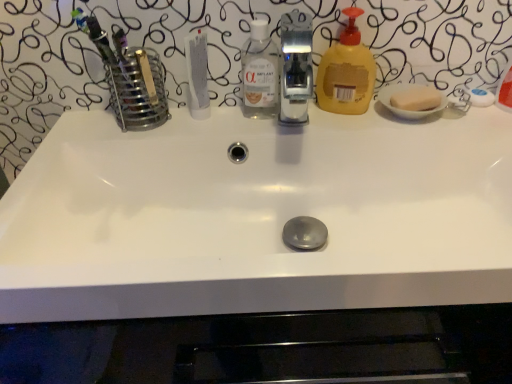
Describe the element at coordinates (197, 74) in the screenshot. The height and width of the screenshot is (384, 512). I see `white matte tube at center` at that location.

Describe the element at coordinates (296, 67) in the screenshot. The height and width of the screenshot is (384, 512). I see `satin nickel faucet at center` at that location.

At what (x,y) coordinates should I click in order to perform the action: click on yellow translucent liquid soap at right. Please return your answer as a coordinate pair (x, y). Looking at the image, I should click on (346, 72).

Is yellow translucent liquid soap at right located within white matte tube at center?

No, yellow translucent liquid soap at right is not inside white matte tube at center.

What's the angular difference between white matte tube at center and yellow translucent liquid soap at right's facing directions?

They differ by 55.8 degrees in their facing directions.

From their relative heights in the image, would you say white matte tube at center is taller or shorter than yellow translucent liquid soap at right?

white matte tube at center is shorter than yellow translucent liquid soap at right.

Based on their sizes in the image, would you say white matte tube at center is bigger or smaller than yellow translucent liquid soap at right?

Clearly, white matte tube at center is smaller in size than yellow translucent liquid soap at right.

Is transparent plastic bottle at center a part of satin nickel faucet at center?

No, transparent plastic bottle at center is located outside of satin nickel faucet at center.

Does satin nickel faucet at center turn towards transparent plastic bottle at center?

No, satin nickel faucet at center is not facing towards transparent plastic bottle at center.

From their relative heights in the image, would you say satin nickel faucet at center is taller or shorter than transparent plastic bottle at center?

Clearly, satin nickel faucet at center is shorter compared to transparent plastic bottle at center.

From the picture: From the image's perspective, which one is positioned higher, satin nickel faucet at center or transparent plastic bottle at center?

From the image's view, transparent plastic bottle at center is above.

Does transparent plastic bottle at center lie behind satin nickel faucet at center?

Yes, transparent plastic bottle at center is further from the viewer.

How different are the orientations of transparent plastic bottle at center and satin nickel faucet at center in degrees?

The angle between the facing direction of transparent plastic bottle at center and the facing direction of satin nickel faucet at center is 0.00231 degrees.

This screenshot has width=512, height=384. What are the coordinates of `fixture in front of the transparent plastic bottle at center` in the screenshot? It's located at (296, 67).

Is there a large distance between white matte tube at center and satin nickel faucet at center?

Yes, white matte tube at center and satin nickel faucet at center are located far from each other.

From a real-world perspective, is white matte tube at center positioned above or below satin nickel faucet at center?

In terms of real-world spatial position, white matte tube at center is below satin nickel faucet at center.

Which is closer, (206, 49) or (306, 51)?

Point (206, 49)

Identify the location of toothpaste on the left of satin nickel faucet at center. (197, 74).

From the image's perspective, is yellow translucent liquid soap at right over transparent plastic bottle at center?

Indeed, from the image's perspective, yellow translucent liquid soap at right is shown above transparent plastic bottle at center.

Is transparent plastic bottle at center located within yellow translucent liquid soap at right?

No, transparent plastic bottle at center is not inside yellow translucent liquid soap at right.

Is transparent plastic bottle at center oriented towards white matte tube at center?

No, transparent plastic bottle at center is not aimed at white matte tube at center.

Locate an element on the screen. toothpaste below the transparent plastic bottle at center (from the image's perspective) is located at coordinates (197, 74).

Looking at their sizes, would you say transparent plastic bottle at center is wider or thinner than white matte tube at center?

Considering their sizes, transparent plastic bottle at center looks broader than white matte tube at center.

Which of these two, transparent plastic bottle at center or white matte tube at center, stands taller?

With more height is transparent plastic bottle at center.

Where is `toothpaste behind the satin nickel faucet at center`? toothpaste behind the satin nickel faucet at center is located at coordinates 197,74.

Is satin nickel faucet at center further to the viewer compared to white matte tube at center?

No, satin nickel faucet at center is closer to the camera.

Is white matte tube at center at the back of satin nickel faucet at center?

No, satin nickel faucet at center is not facing the opposite direction of white matte tube at center.

Based on their sizes in the image, would you say satin nickel faucet at center is bigger or smaller than white matte tube at center?

Clearly, satin nickel faucet at center is larger in size than white matte tube at center.

This screenshot has height=384, width=512. In order to click on cleaning product above the white matte tube at center (from the image's perspective) in this screenshot , I will do `click(346, 72)`.

The width and height of the screenshot is (512, 384). In order to click on bottle beneath the satin nickel faucet at center (from a real-world perspective) in this screenshot , I will do `click(259, 73)`.

Based on their spatial positions, is yellow translucent liquid soap at right or transparent plastic bottle at center further from satin nickel faucet at center?

transparent plastic bottle at center is positioned further to the anchor satin nickel faucet at center.

Estimate the real-world distances between objects in this image. Which object is further from transparent plastic bottle at center, satin nickel faucet at center or white matte tube at center?

Among the two, satin nickel faucet at center is located further to transparent plastic bottle at center.

Based on their spatial positions, is satin nickel faucet at center or yellow translucent liquid soap at right further from white matte tube at center?

Among the two, satin nickel faucet at center is located further to white matte tube at center.

Based on their spatial positions, is transparent plastic bottle at center or white matte tube at center closer to satin nickel faucet at center?

transparent plastic bottle at center lies closer to satin nickel faucet at center than the other object.

Looking at the image, which one is located further to satin nickel faucet at center, transparent plastic bottle at center or yellow translucent liquid soap at right?

transparent plastic bottle at center.

Considering their positions, is transparent plastic bottle at center positioned closer to white matte tube at center than satin nickel faucet at center?

Among the two, transparent plastic bottle at center is located nearer to white matte tube at center.

Looking at the image, which one is located further to white matte tube at center, satin nickel faucet at center or transparent plastic bottle at center?

Among the two, satin nickel faucet at center is located further to white matte tube at center.

Looking at the image, which one is located further to yellow translucent liquid soap at right, white matte tube at center or transparent plastic bottle at center?

white matte tube at center lies further to yellow translucent liquid soap at right than the other object.

This screenshot has width=512, height=384. I want to click on fixture situated between transparent plastic bottle at center and yellow translucent liquid soap at right from left to right, so click(x=296, y=67).

This screenshot has height=384, width=512. Identify the location of bottle situated between white matte tube at center and yellow translucent liquid soap at right from left to right. (259, 73).

This screenshot has width=512, height=384. Identify the location of bottle situated between white matte tube at center and satin nickel faucet at center from left to right. (259, 73).

Locate an element on the screen. fixture situated between white matte tube at center and yellow translucent liquid soap at right from left to right is located at coordinates (296, 67).